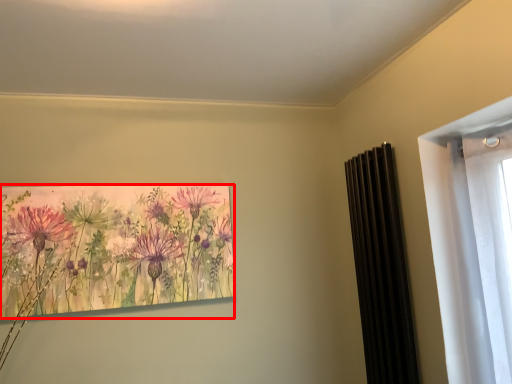
Question: From the image's perspective, considering the relative positions of flower (annotated by the red box) and radiator in the image provided, where is flower (annotated by the red box) located with respect to the staircase?

Choices:
 (A) above
 (B) below

Answer: (A)